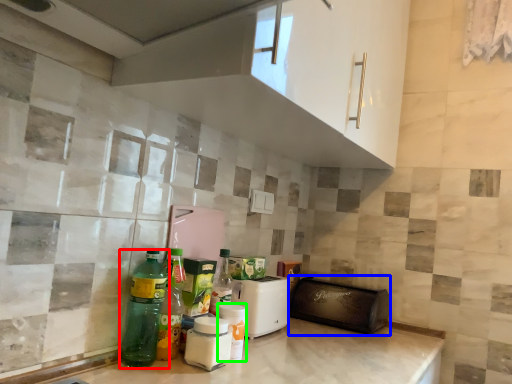
Question: Which object is the farthest from bottle (highlighted by a red box)? Choose among these: appliance (highlighted by a blue box) or bottle (highlighted by a green box).

Choices:
 (A) appliance
 (B) bottle

Answer: (A)